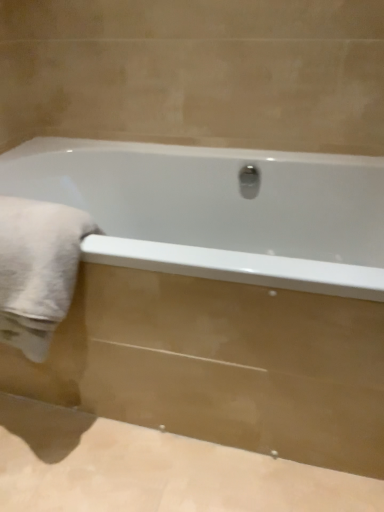
Where is `white soft towel at left`? white soft towel at left is located at coordinates (37, 270).

The width and height of the screenshot is (384, 512). What do you see at coordinates (37, 270) in the screenshot? I see `white soft towel at left` at bounding box center [37, 270].

The image size is (384, 512). What do you see at coordinates (219, 296) in the screenshot? I see `white glossy bathtub at center` at bounding box center [219, 296].

Where is `white glossy bathtub at center`? Image resolution: width=384 pixels, height=512 pixels. white glossy bathtub at center is located at coordinates (219, 296).

At what (x,y) coordinates should I click in order to perform the action: click on white soft towel at left. Please return your answer as a coordinate pair (x, y). This screenshot has width=384, height=512. Looking at the image, I should click on (37, 270).

Is white soft towel at left at the left side of white glossy bathtub at center?

Yes.

Which object is further away from the camera taking this photo, white soft towel at left or white glossy bathtub at center?

white soft towel at left is behind.

Does point (37, 244) come closer to viewer compared to point (204, 254)?

No.

From the image's perspective, does white soft towel at left appear higher than white glossy bathtub at center?

Indeed, from the image's perspective, white soft towel at left is shown above white glossy bathtub at center.

From a real-world perspective, which is physically below, white soft towel at left or white glossy bathtub at center?

white glossy bathtub at center.

Looking at their sizes, would you say white soft towel at left is wider or thinner than white glossy bathtub at center?

Clearly, white soft towel at left has less width compared to white glossy bathtub at center.

Who is shorter, white soft towel at left or white glossy bathtub at center?

white soft towel at left.

Who is smaller, white soft towel at left or white glossy bathtub at center?

white soft towel at left.

Could white glossy bathtub at center be considered to be inside white soft towel at left?

No, white glossy bathtub at center is located outside of white soft towel at left.

Is white soft towel at left touching white glossy bathtub at center?

No, white soft towel at left is not with white glossy bathtub at center.

Is white soft towel at left oriented towards white glossy bathtub at center?

Yes, white soft towel at left is aimed at white glossy bathtub at center.

What's the angular difference between white soft towel at left and white glossy bathtub at center's facing directions?

The facing directions of white soft towel at left and white glossy bathtub at center are 4.52e-06 degrees apart.

The width and height of the screenshot is (384, 512). In order to click on bath towel behind the white glossy bathtub at center in this screenshot , I will do `click(37, 270)`.

Can you confirm if white glossy bathtub at center is positioned to the left of white soft towel at left?

No, white glossy bathtub at center is not to the left of white soft towel at left.

Relative to white soft towel at left, is white glossy bathtub at center in front or behind?

Clearly, white glossy bathtub at center is in front of white soft towel at left.

Is point (343, 401) less distant than point (36, 300)?

No, (343, 401) is further to viewer.

From the image's perspective, between white glossy bathtub at center and white soft towel at left, who is located below?

white glossy bathtub at center, from the image's perspective.

Based on the photo, from a real-world perspective, is white glossy bathtub at center on top of white soft towel at left?

Actually, white glossy bathtub at center is physically below white soft towel at left in the real world.

Does white glossy bathtub at center have a lesser width compared to white soft towel at left?

No, white glossy bathtub at center is not thinner than white soft towel at left.

Which of these two, white glossy bathtub at center or white soft towel at left, stands taller?

white glossy bathtub at center.

Considering the sizes of white glossy bathtub at center and white soft towel at left in the image, is white glossy bathtub at center bigger or smaller than white soft towel at left?

Clearly, white glossy bathtub at center is larger in size than white soft towel at left.

Is white glossy bathtub at center positioned beyond the bounds of white soft towel at left?

Absolutely, white glossy bathtub at center is external to white soft towel at left.

Is white glossy bathtub at center next to white soft towel at left?

No, white glossy bathtub at center is not making contact with white soft towel at left.

Is white glossy bathtub at center turned away from white soft towel at left?

No, white glossy bathtub at center's orientation is not away from white soft towel at left.

What's the angular difference between white glossy bathtub at center and white soft towel at left's facing directions?

4.52e-06 degrees.

At what (x,y) coordinates should I click in order to perform the action: click on bathtub below the white soft towel at left (from a real-world perspective). Please return your answer as a coordinate pair (x, y). Looking at the image, I should click on (219, 296).

Locate an element on the screen. bath towel that is above the white glossy bathtub at center (from a real-world perspective) is located at coordinates (37, 270).

Identify the location of bathtub located in front of the white soft towel at left. The height and width of the screenshot is (512, 384). (219, 296).